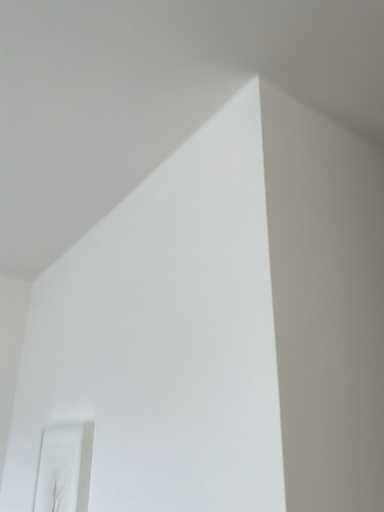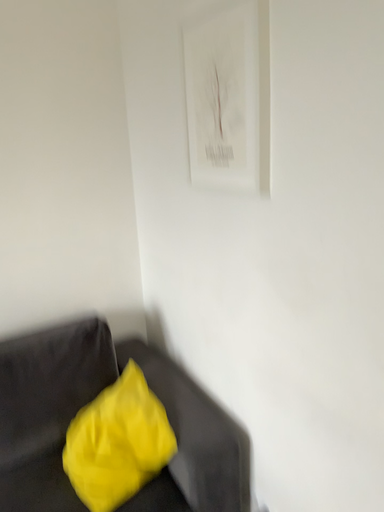
Question: How did the camera likely rotate when shooting the video?

Choices:
 (A) rotated upward
 (B) rotated downward

Answer: (B)